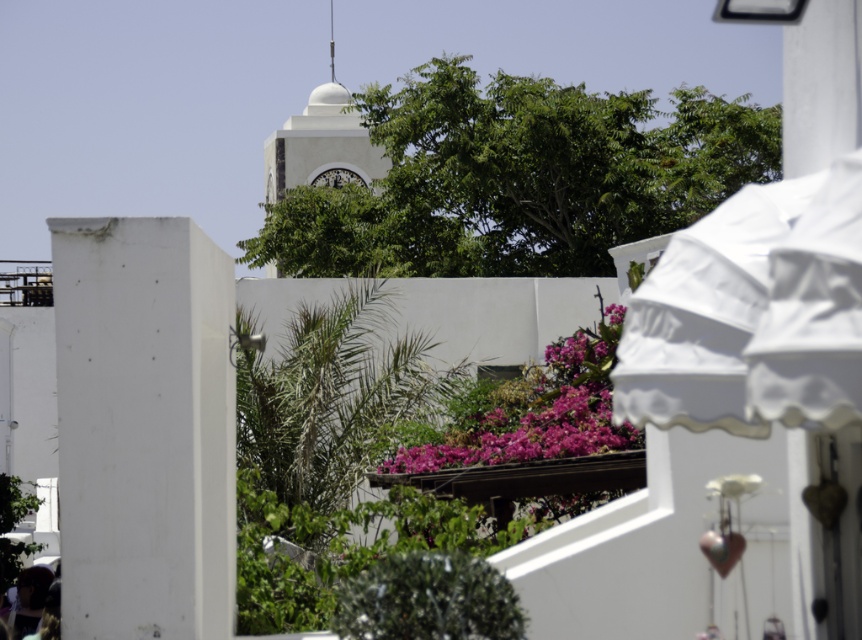
Question: From the image, what is the correct spatial relationship of white matte pillar at left in relation to white smooth clock tower at center?

Choices:
 (A) right
 (B) left

Answer: (A)

Question: Which object is farther from the camera taking this photo?

Choices:
 (A) green leafy bush at center
 (B) pink matte flowers at center
 (C) white matte pillar at left
 (D) white smooth clock tower at center

Answer: (D)

Question: Estimate the real-world distances between objects in this image. Which object is farther from the white matte pillar at left?

Choices:
 (A) pink matte flowers at center
 (B) green leafy bush at center

Answer: (A)

Question: Which point is closer to the camera taking this photo?

Choices:
 (A) (345, 97)
 (B) (486, 452)
 (C) (183, 540)
 (D) (416, 566)

Answer: (D)

Question: Considering the relative positions of white matte pillar at left and green leafy bush at center in the image provided, where is white matte pillar at left located with respect to green leafy bush at center?

Choices:
 (A) below
 (B) above

Answer: (B)

Question: Can you confirm if white matte pillar at left is positioned to the right of white smooth clock tower at center?

Choices:
 (A) no
 (B) yes

Answer: (B)